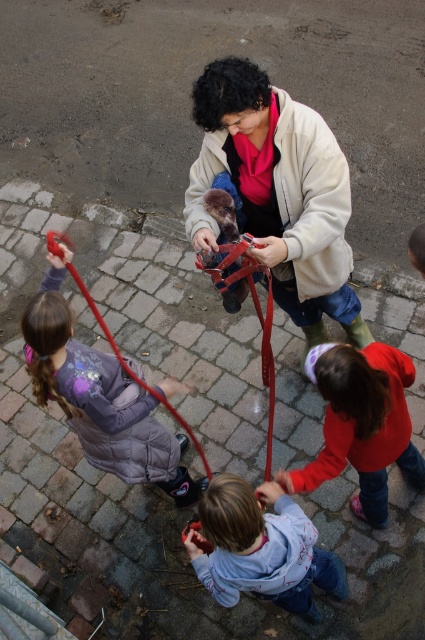
Does light blue cotton shirt at center have a greater width compared to red matte jacket at lower right?

No.

Is light blue cotton shirt at center positioned in front of red matte jacket at lower right?

Yes, light blue cotton shirt at center is closer to the viewer.

Measure the distance between light blue cotton shirt at center and camera.

A distance of 7.24 feet exists between light blue cotton shirt at center and camera.

Identify the location of light blue cotton shirt at center. This screenshot has width=425, height=640. (260, 548).

In order to click on white fleece jacket at center in this screenshot , I will do `click(277, 193)`.

Is white fleece jacket at center to the right of red matte jacket at lower right from the viewer's perspective?

No, white fleece jacket at center is not to the right of red matte jacket at lower right.

Is point (280, 196) behind point (342, 353)?

That is True.

Locate an element on the screen. The height and width of the screenshot is (640, 425). white fleece jacket at center is located at coordinates (277, 193).

Looking at this image, is purple fuzzy jacket at lower left wider than red matte jacket at lower right?

No, purple fuzzy jacket at lower left is not wider than red matte jacket at lower right.

Can you confirm if purple fuzzy jacket at lower left is smaller than red matte jacket at lower right?

No.

Who is more forward, (200,481) or (413,470)?

Point (413,470) is in front.

Locate an element on the screen. purple fuzzy jacket at lower left is located at coordinates (102, 397).